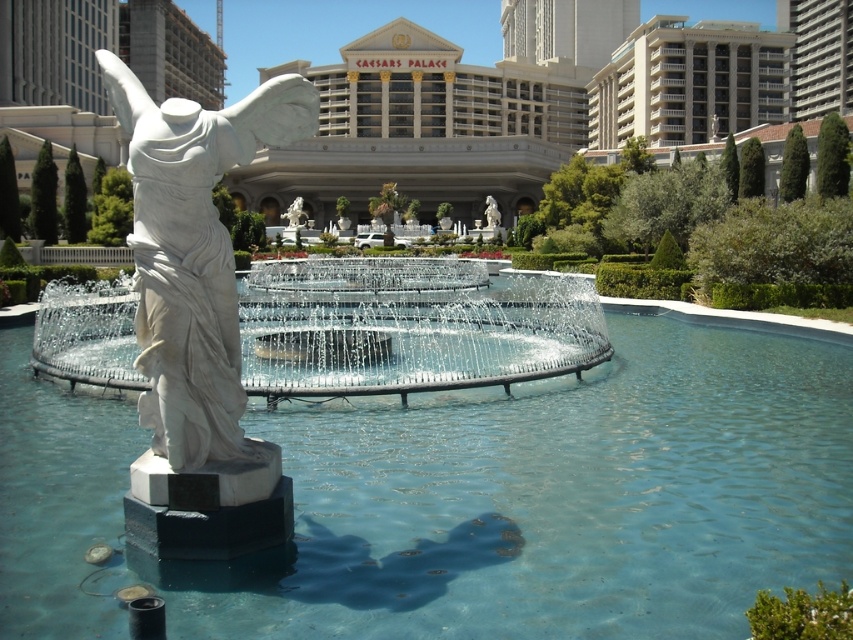
You are standing at the viewpoint of the image and want to place a small decorative rock between the two points, point [248,321] and point [166,404]. Which point should you place it closer to in order for the rock to appear closer to the viewer?

To make the decorative rock appear closer to the viewer, you should place it closer to point [166,404] because point [248,321] is behind point [166,404], so placing the rock near the front point would bring it closer to the viewer.

What are the coordinates of the clear glass pool at center?

The clear glass pool at center is located at coordinates point (468,499).

You are designing a garden layout and want to place a new decorative stone path around the clear glass pool at center and the white marble fountain at center. Which object requires a larger path circumference to accommodate its size?

The white marble fountain at center requires a larger path circumference because it is bigger than the clear glass pool at center.